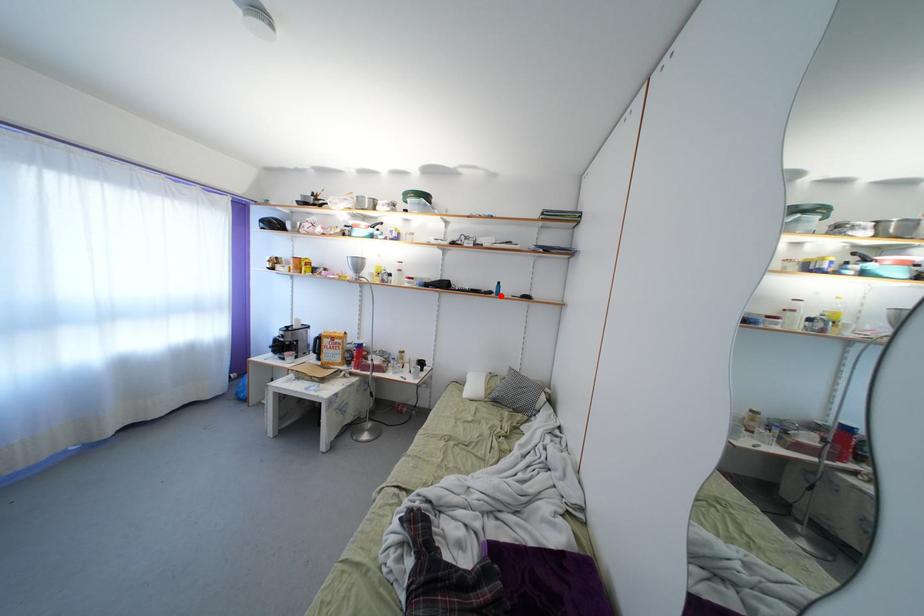
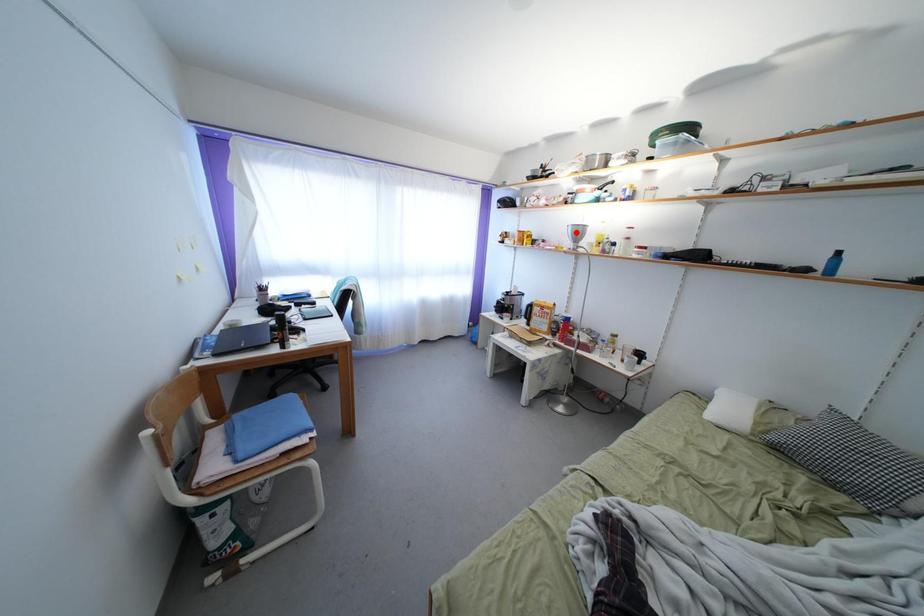
I am providing you with two images of the same scene from different viewpoints. A red point is marked on the first image and another point is marked on the second image. Is the marked point in image1 the same physical position as the marked point in image2?

No